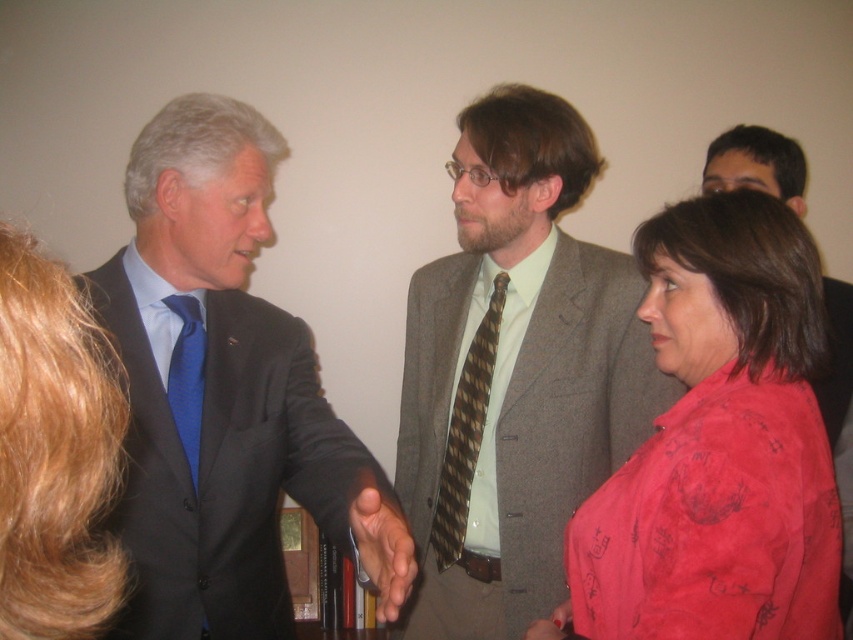
Is point (221, 163) in front of point (837, 403)?

Yes, point (221, 163) is closer to viewer.

What do you see at coordinates (224, 396) in the screenshot? I see `matte black suit at center` at bounding box center [224, 396].

Locate an element on the screen. The image size is (853, 640). matte black suit at center is located at coordinates (224, 396).

Where is `matte red blouse at center`? This screenshot has width=853, height=640. matte red blouse at center is located at coordinates (718, 445).

Measure the distance between matte red blouse at center and brown striped tie at center.

matte red blouse at center and brown striped tie at center are 53.72 centimeters apart.

This screenshot has width=853, height=640. I want to click on matte red blouse at center, so click(x=718, y=445).

Can you confirm if matte black suit at center is positioned above gray wool suit at center?

Yes.

Is matte black suit at center closer to the viewer compared to gray wool suit at center?

That is True.

Between point (244, 504) and point (496, 468), which one is positioned behind?

The point (496, 468) is more distant.

Locate an element on the screen. matte black suit at center is located at coordinates (224, 396).